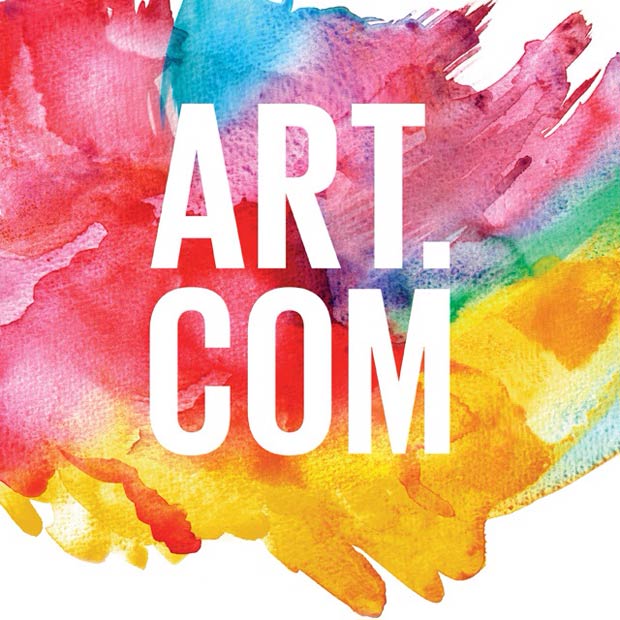
I want to click on light blue paint bottom right, so click(x=591, y=441).